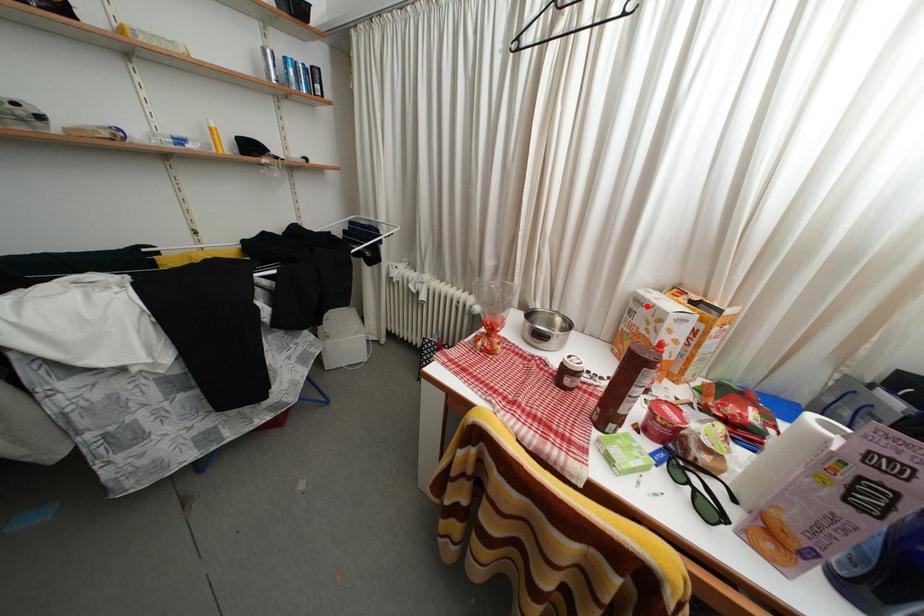
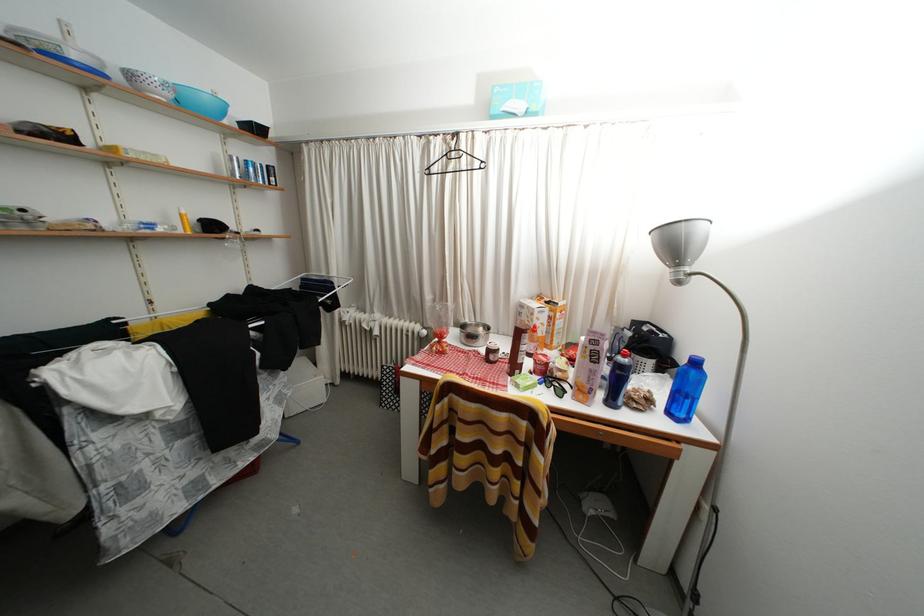
Find the pixel in the second image that matches the highlighted location in the first image.

(529, 310)